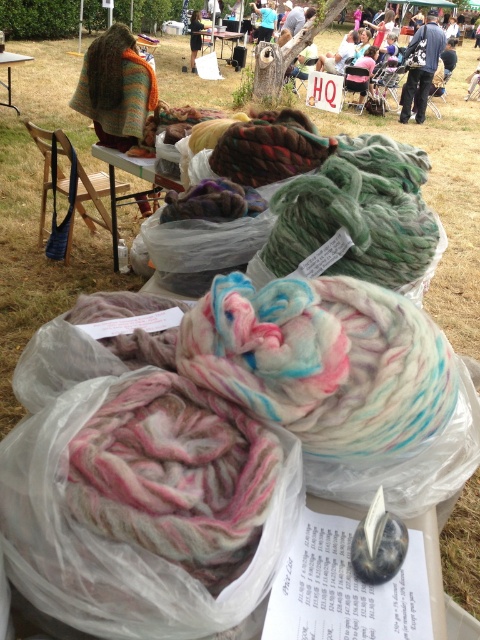
You are standing at the market and want to take a photo of the two points labeled as point (96, 148) and point (9, 90). Which point will appear larger in your photo?

Point (96, 148) will appear larger in the photo because it is closer to the camera than point (9, 90).

You are standing at the entrance of the market and want to pick up the multicolored wool at center and place it on the wooden table at center. Can you do this without moving any other items?

The multicolored wool at center is closer to the viewer than the wooden table at center, so you can easily pick it up and place it on the wooden table at center without needing to move other items.